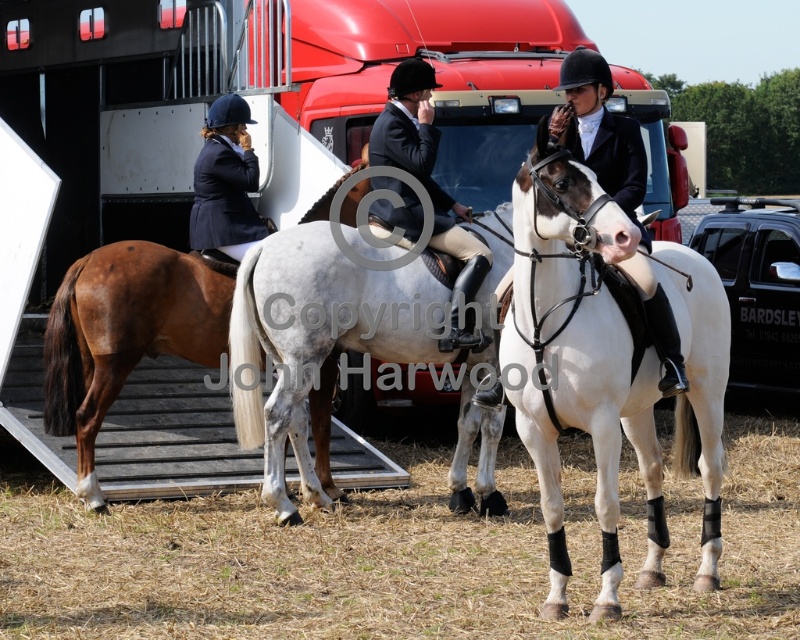
From the picture: You are at a horse show and need to locate the trailer where the horses are kept. The coordinates given are point (260, 99). According to the scene, where is this point located?

The point (260, 99) corresponds to the metallic red trailer truck at center.